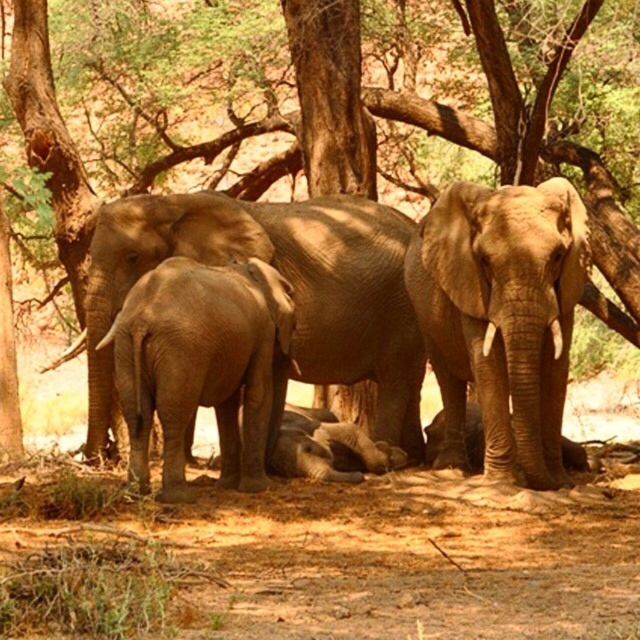
You are a wildlife photographer trying to capture a photo of the smooth gray elephant at center and the brown textured tree at center. Based on their positions, which object should you adjust your camera focus to first to ensure both are in the frame?

The smooth gray elephant at center is to the left of brown textured tree at center, so you should focus on the brown textured tree at center first to ensure both are in the frame.

You are an animal researcher observing the elephants and the tree in the image. Which object is closer to you, the smooth gray elephant at center or the brown textured tree at center?

The smooth gray elephant at center is closer to you because it is in front of the brown textured tree at center.